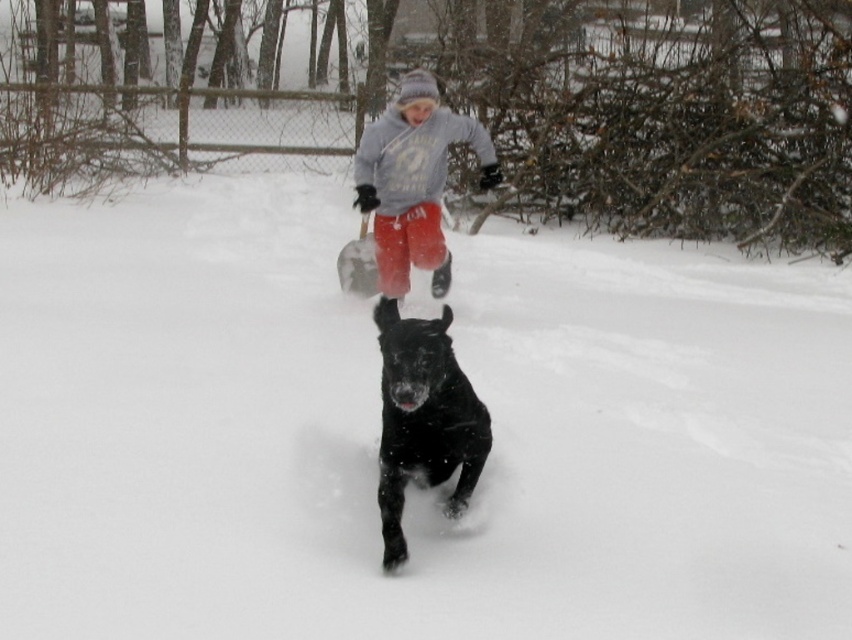
Question: Which of the following is the closest to the observer?

Choices:
 (A) (413, 92)
 (B) (436, 428)

Answer: (B)

Question: Does black glossy dog at center have a smaller size compared to gray fleece sweatshirt at center?

Choices:
 (A) no
 (B) yes

Answer: (B)

Question: Can you confirm if white fluffy snow at center is positioned to the right of gray fleece sweatshirt at center?

Choices:
 (A) yes
 (B) no

Answer: (B)

Question: Which point appears farthest from the camera in this image?

Choices:
 (A) (337, 340)
 (B) (475, 438)
 (C) (376, 211)

Answer: (A)

Question: Which point is closer to the camera taking this photo?

Choices:
 (A) (273, 416)
 (B) (400, 170)
 (C) (393, 413)

Answer: (C)

Question: Can you confirm if black glossy dog at center is wider than gray fleece sweatshirt at center?

Choices:
 (A) no
 (B) yes

Answer: (A)